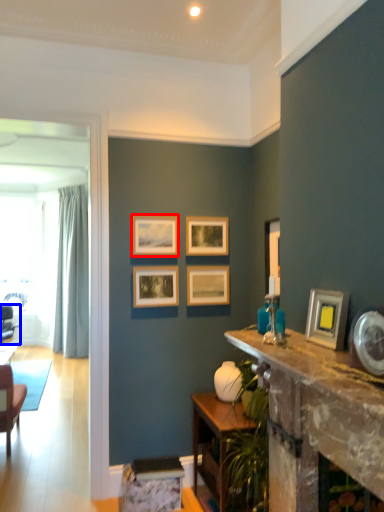
Question: Which object is further to the camera taking this photo, picture frame (highlighted by a red box) or chair (highlighted by a blue box)?

Choices:
 (A) picture frame
 (B) chair

Answer: (B)